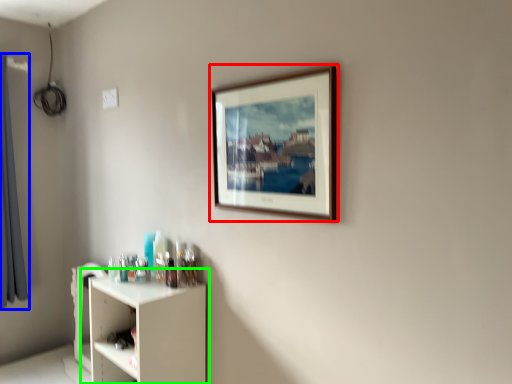
Question: Considering the real-world distances, which object is closest to picture frame (highlighted by a red box)? curtain (highlighted by a blue box) or shelf (highlighted by a green box).

Choices:
 (A) curtain
 (B) shelf

Answer: (B)